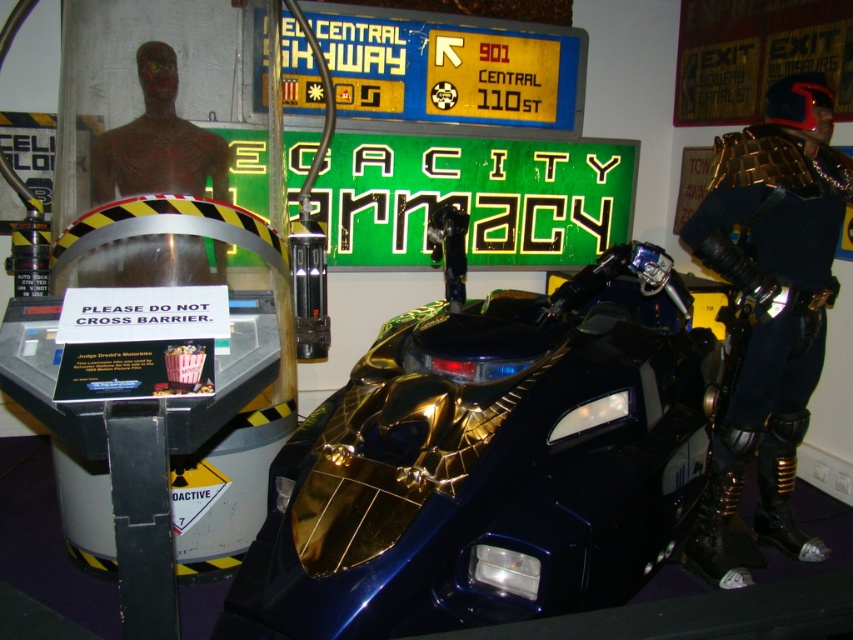
Is point (376, 484) less distant than point (741, 193)?

Yes, it is in front of point (741, 193).

Does point (376, 454) lie in front of point (757, 321)?

Yes.

Image resolution: width=853 pixels, height=640 pixels. I want to click on gold-plated motorcycle at center, so pyautogui.click(x=488, y=460).

Who is taller, gold plated armor at center or smooth brown bust at center?

gold plated armor at center

At what (x,y) coordinates should I click in order to perform the action: click on gold plated armor at center. Please return your answer as a coordinate pair (x, y). Looking at the image, I should click on (769, 310).

Measure the distance between gold plated armor at center and camera.

gold plated armor at center is 2.96 meters away from camera.

You are a GUI agent. You are given a task and a screenshot of the screen. Output one action in this format:
    pyautogui.click(x=<x>, y=<y>)
    Task: Click on the gold plated armor at center
    This screenshot has height=640, width=853.
    Given the screenshot: What is the action you would take?
    click(769, 310)

Describe the element at coordinates (488, 460) in the screenshot. I see `gold-plated motorcycle at center` at that location.

Who is shorter, gold-plated motorcycle at center or smooth brown bust at center?

smooth brown bust at center is shorter.

Identify the location of gold-plated motorcycle at center. Image resolution: width=853 pixels, height=640 pixels. (488, 460).